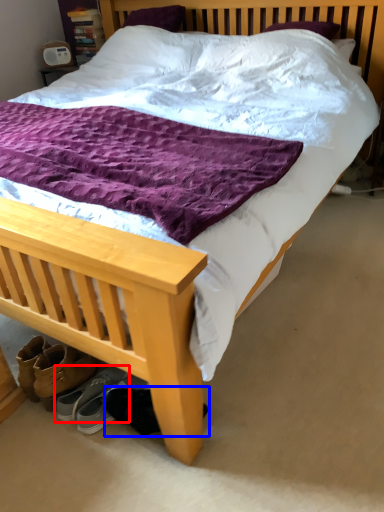
Question: Which object appears farthest to the camera in this image, footwear (highlighted by a red box) or footwear (highlighted by a blue box)?

Choices:
 (A) footwear
 (B) footwear

Answer: (A)